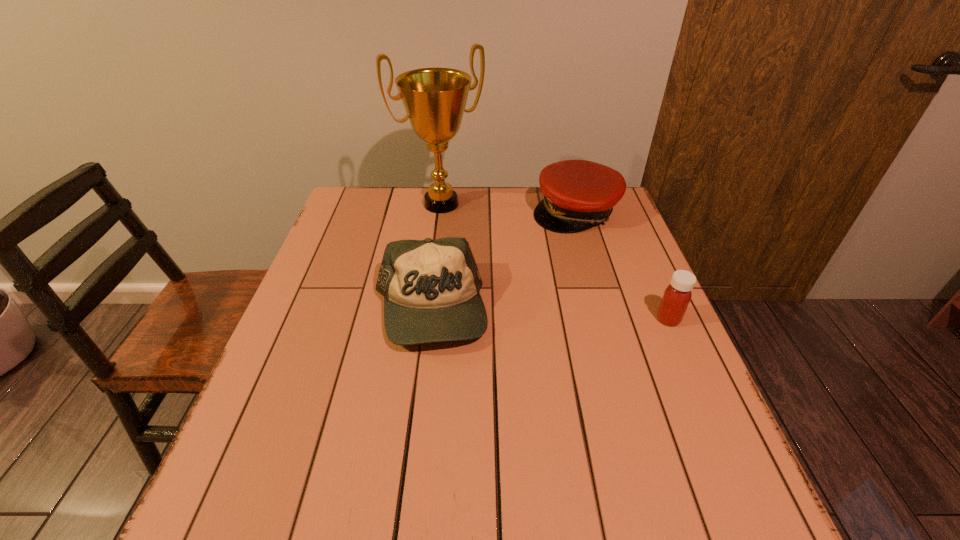
This screenshot has height=540, width=960. What are the coordinates of `free space that satisfies the following two spatial constraints: 1. on the front side of the cap; 2. on the right side of the award` in the screenshot? It's located at (441, 212).

Find the location of `free spot that satisfies the following two spatial constraints: 1. on the front-facing side of the baseball cap; 2. on the left side of the medicine`. free spot that satisfies the following two spatial constraints: 1. on the front-facing side of the baseball cap; 2. on the left side of the medicine is located at coordinates (428, 319).

What are the coordinates of `vacant space that satisfies the following two spatial constraints: 1. on the front side of the award; 2. on the left side of the medicine` in the screenshot? It's located at (427, 319).